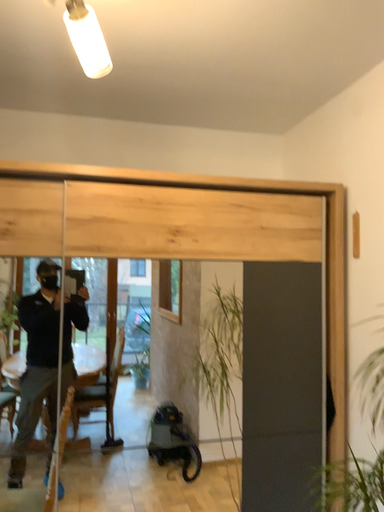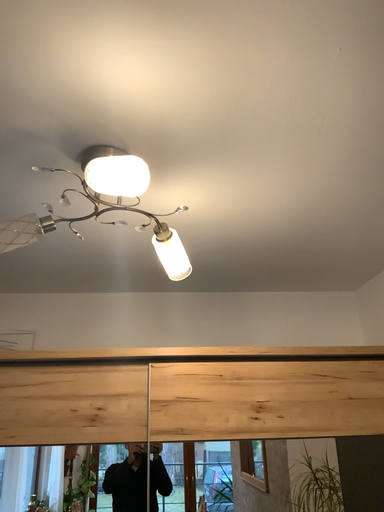
Question: How did the camera likely rotate when shooting the video?

Choices:
 (A) rotated upward
 (B) rotated downward

Answer: (A)